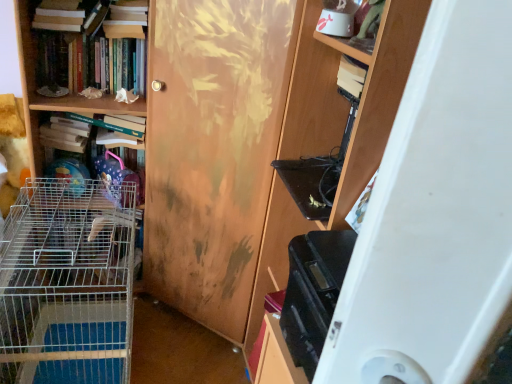
At what (x,y) coordinates should I click in order to perform the action: click on vacant area on top of silver wire cage at left (from a real-world perspective). Please return your answer as a coordinate pair (x, y). The image size is (512, 384). Looking at the image, I should click on (69, 226).